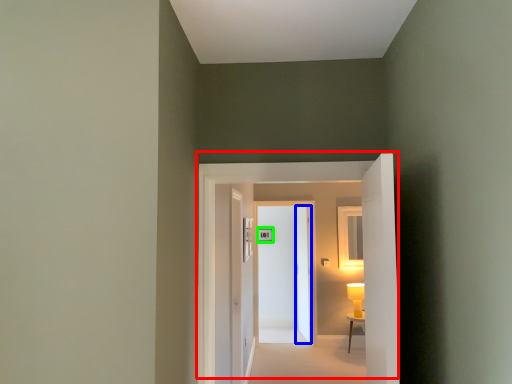
Question: Considering the real-world distances, which object is farthest from door (highlighted by a red box)? door (highlighted by a blue box) or picture frame (highlighted by a green box)?

Choices:
 (A) door
 (B) picture frame

Answer: (B)